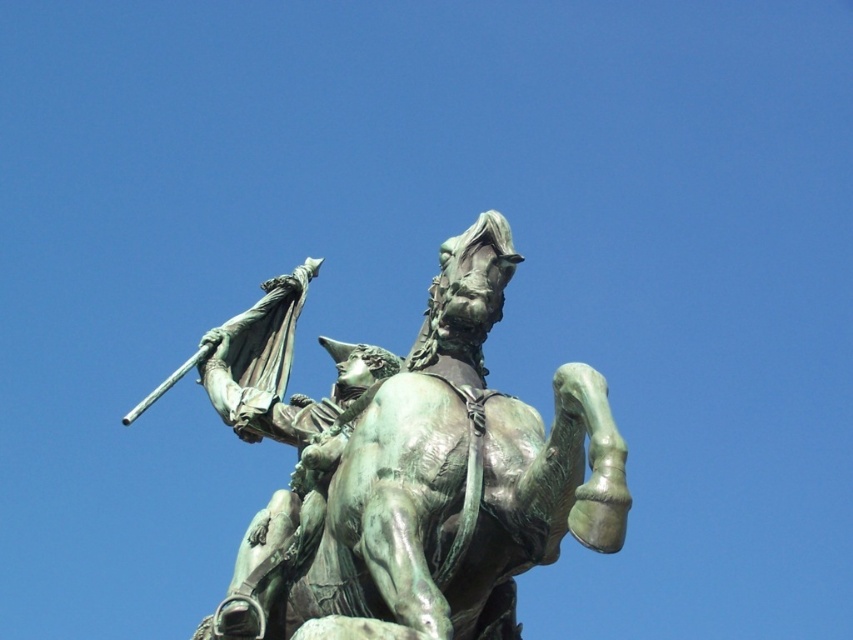
You are an art conservator assessing the space between two statues in a courtyard. You need to place a protective barrier between them. The green patina bronze horse and rider at center and the green patina statue at upper center are both in view. Which statue has a larger width, and will the barrier fit if it requires at least 1 meter of space between them?

The green patina bronze horse and rider at center might be wider than green patina statue at upper center. However, the description only states that the horse and rider might be wider, but does not provide exact measurements. Without specific width details, it is uncertain if the barrier requiring 1 meter of space will fit between them.

You are an art student analyzing the statue placement in the image. You notice two green patina statues. The first is the green patina bronze horse and rider at center, and the second is the green patina statue at upper center. Which of these two statues is taller?

The green patina bronze horse and rider at center is much taller than the green patina statue at upper center.